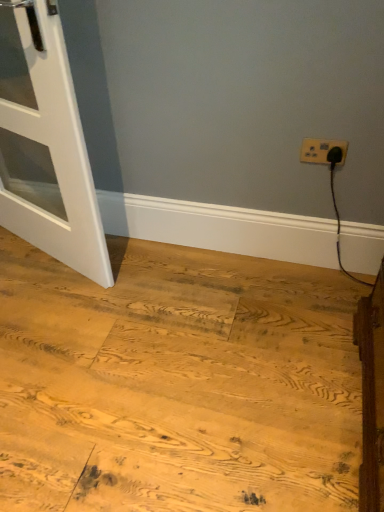
Question: Does white matte door at left have a greater height compared to natural wood floor at lower left?

Choices:
 (A) no
 (B) yes

Answer: (B)

Question: Is white matte door at left outside natural wood floor at lower left?

Choices:
 (A) yes
 (B) no

Answer: (A)

Question: Is white matte door at left in contact with natural wood floor at lower left?

Choices:
 (A) yes
 (B) no

Answer: (B)

Question: Does white matte door at left have a larger size compared to natural wood floor at lower left?

Choices:
 (A) yes
 (B) no

Answer: (B)

Question: From the image's perspective, is white matte door at left under natural wood floor at lower left?

Choices:
 (A) no
 (B) yes

Answer: (A)

Question: Considering the relative positions of white matte door at left and natural wood floor at lower left in the image provided, is white matte door at left in front of natural wood floor at lower left?

Choices:
 (A) yes
 (B) no

Answer: (B)

Question: Is white matte door at left smaller than white plastic power plugs and sockets at upper right?

Choices:
 (A) no
 (B) yes

Answer: (A)

Question: Is white matte door at left closer to the viewer compared to white plastic power plugs and sockets at upper right?

Choices:
 (A) no
 (B) yes

Answer: (B)

Question: Does white matte door at left have a lesser height compared to white plastic power plugs and sockets at upper right?

Choices:
 (A) no
 (B) yes

Answer: (A)

Question: From a real-world perspective, is white matte door at left physically above white plastic power plugs and sockets at upper right?

Choices:
 (A) no
 (B) yes

Answer: (B)

Question: Is white matte door at left positioned beyond the bounds of white plastic power plugs and sockets at upper right?

Choices:
 (A) no
 (B) yes

Answer: (B)

Question: Considering the relative sizes of white matte door at left and white plastic power plugs and sockets at upper right in the image provided, is white matte door at left bigger than white plastic power plugs and sockets at upper right?

Choices:
 (A) yes
 (B) no

Answer: (A)

Question: Considering the relative positions of natural wood floor at lower left and white matte door at left in the image provided, is natural wood floor at lower left to the left of white matte door at left from the viewer's perspective?

Choices:
 (A) yes
 (B) no

Answer: (B)